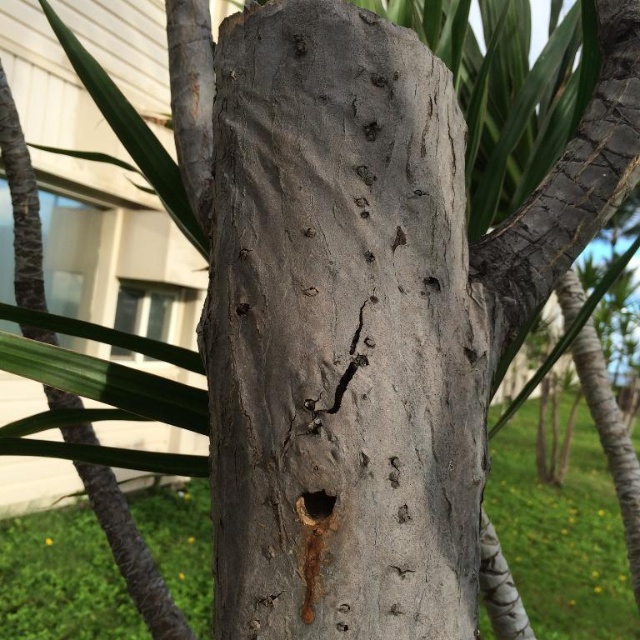
Based on the photo, who is lower down, gray rough bark tree trunk at center or smooth dark brown hole at center?

smooth dark brown hole at center is lower down.

Is point (220, 385) closer to viewer compared to point (300, 504)?

No, (220, 385) is behind (300, 504).

What do you see at coordinates (340, 332) in the screenshot? I see `gray rough bark tree trunk at center` at bounding box center [340, 332].

At what (x,y) coordinates should I click in order to perform the action: click on gray rough bark tree trunk at center. Please return your answer as a coordinate pair (x, y). This screenshot has width=640, height=640. Looking at the image, I should click on (340, 332).